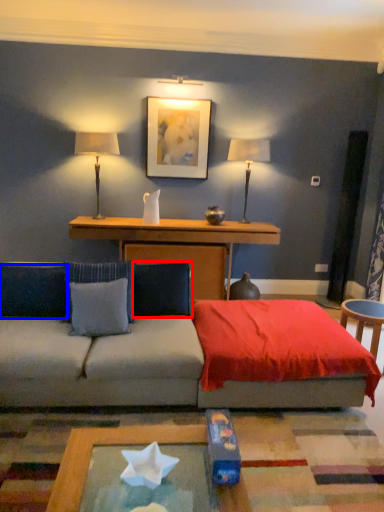
Question: Among these objects, which one is farthest to the camera, pillow (highlighted by a red box) or pillow (highlighted by a blue box)?

Choices:
 (A) pillow
 (B) pillow

Answer: (A)